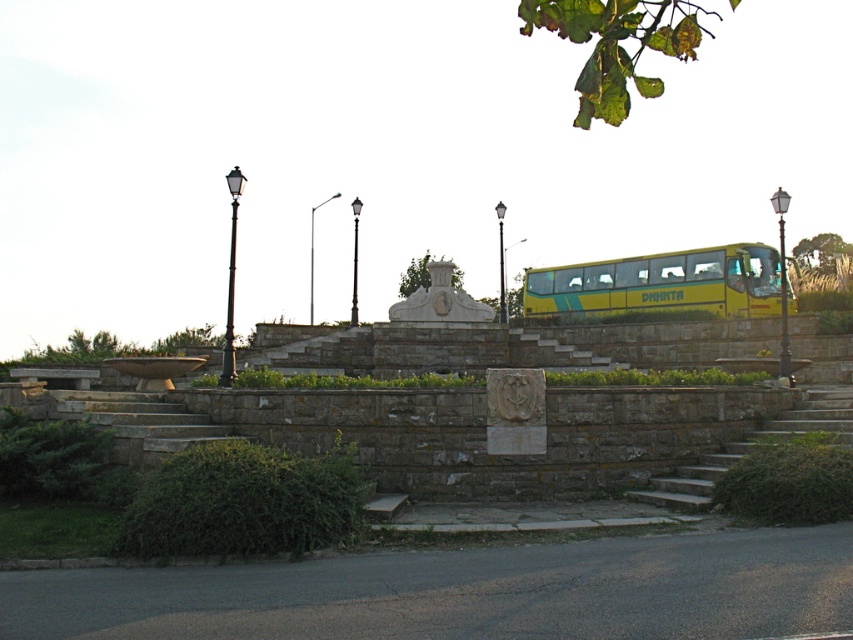
Question: Which point is closer to the camera?

Choices:
 (A) yellow/green painted bus at right
 (B) stone steps at lower right

Answer: (B)

Question: Observing the image, what is the correct spatial positioning of yellow/green painted bus at right in reference to stone steps at lower right?

Choices:
 (A) right
 (B) left

Answer: (A)

Question: In this image, where is yellow/green painted bus at right located relative to stone steps at lower right?

Choices:
 (A) right
 (B) left

Answer: (A)

Question: Does yellow/green painted bus at right appear over stone steps at lower right?

Choices:
 (A) yes
 (B) no

Answer: (A)

Question: Which point is farther from the camera taking this photo?

Choices:
 (A) (688, 481)
 (B) (764, 273)

Answer: (B)